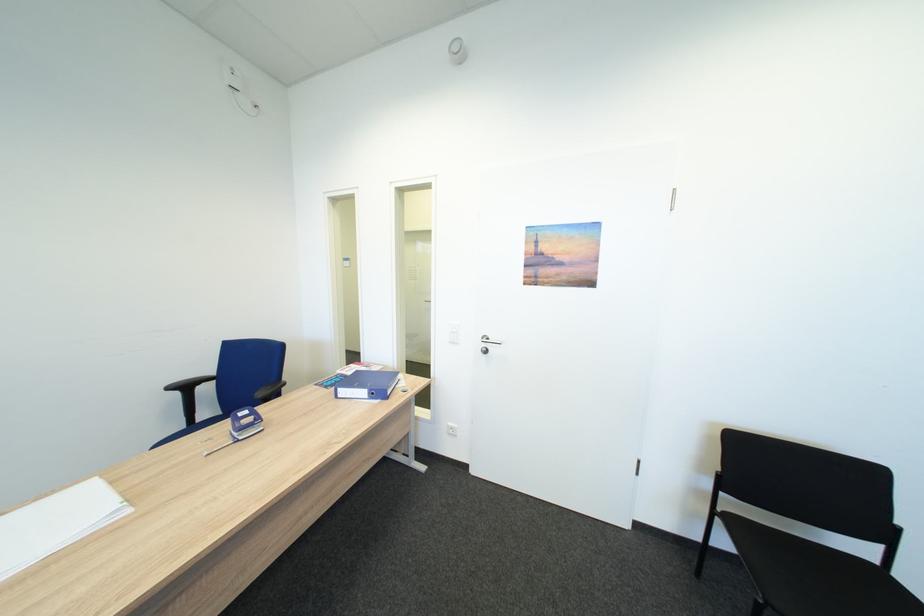
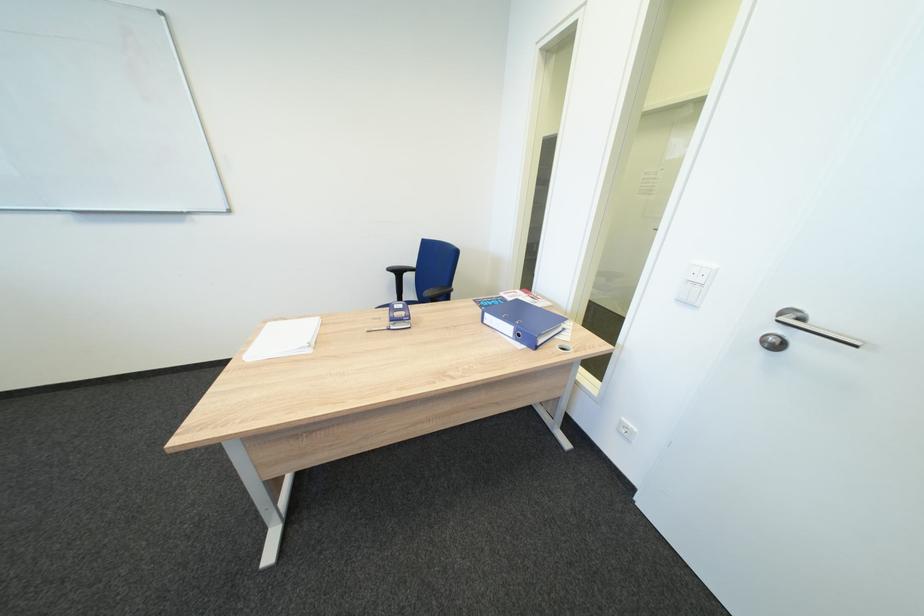
In the second image, find the point that corresponds to (460,344) in the first image.

(687, 302)